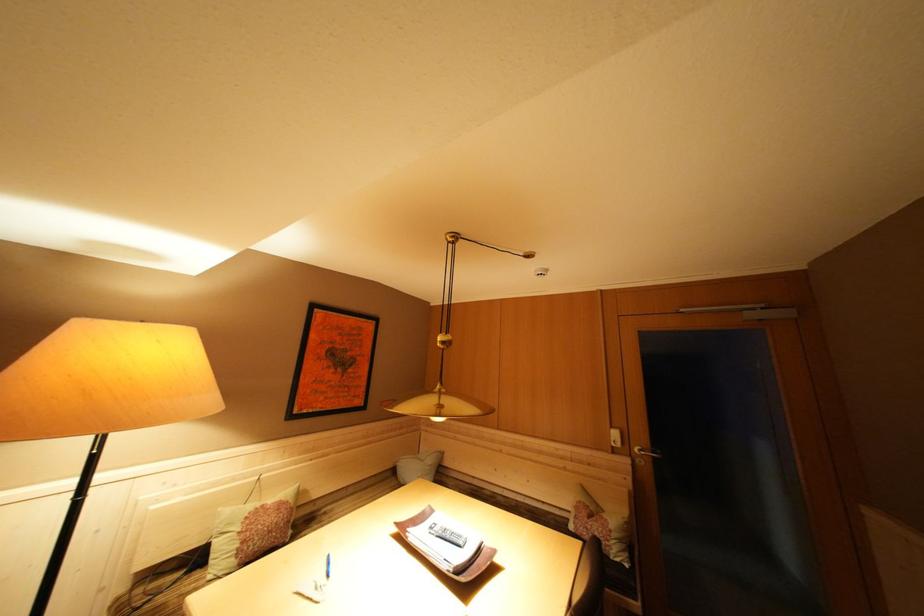
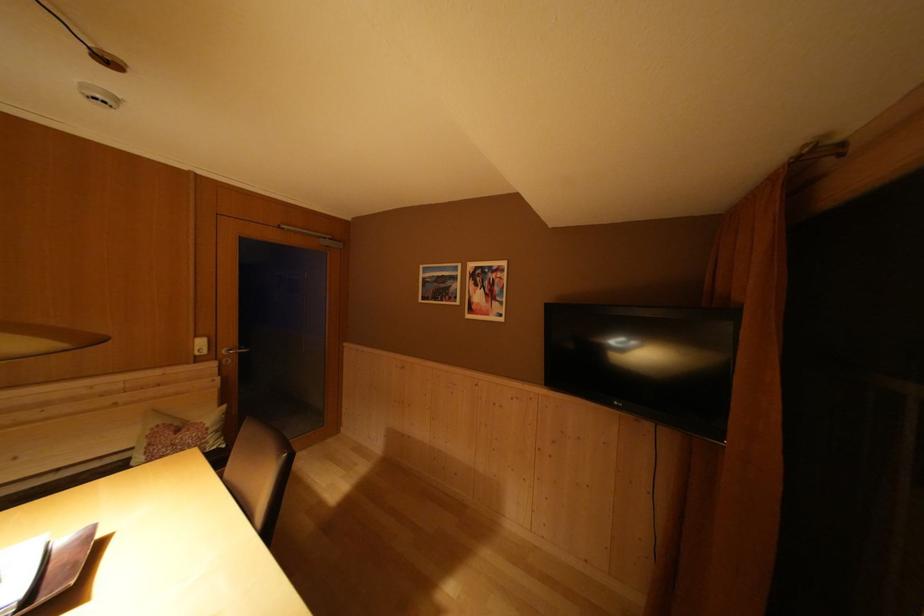
In the second image, find the point that corresponds to the point at 618,432 in the first image.

(203, 342)